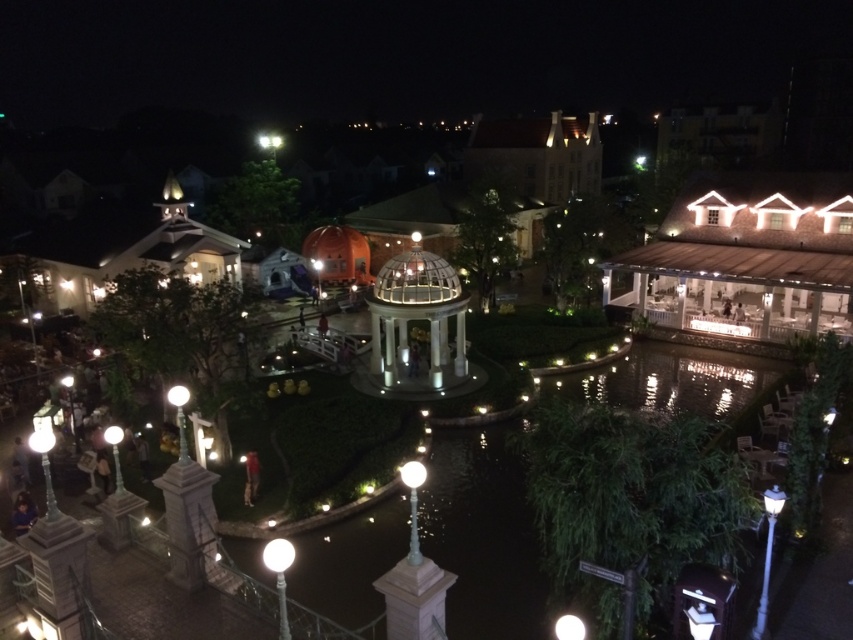
You are a visitor at the park and want to take a photo of the white glass gazebo at center and the clear water at center. Where should you position yourself to capture both in the same frame?

Position yourself at a viewpoint where you can see both the white glass gazebo at center and the clear water at center. Since the clear water at center is located below the white glass gazebo at center, standing at a lower elevation or angle will allow you to include both in your photo.